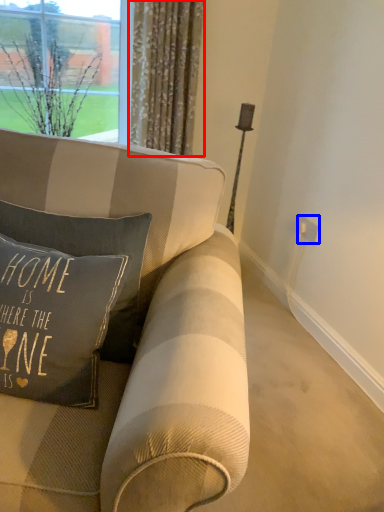
Question: Among these objects, which one is farthest to the camera, curtain (highlighted by a red box) or electric outlet (highlighted by a blue box)?

Choices:
 (A) curtain
 (B) electric outlet

Answer: (B)